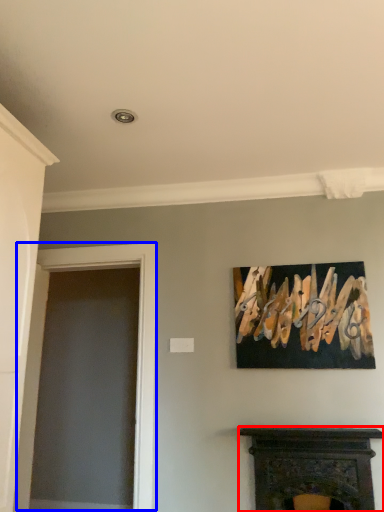
Question: Which point is closer to the camera, fireplace (highlighted by a red box) or glass door (highlighted by a blue box)?

Choices:
 (A) fireplace
 (B) glass door

Answer: (A)